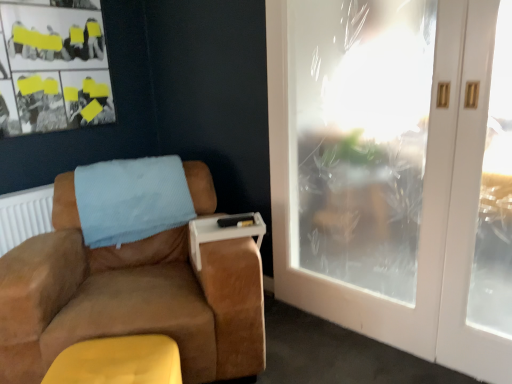
Locate an element on the screen. The image size is (512, 384). free space above yellow suede footrest at lower left (from a real-world perspective) is located at coordinates (101, 362).